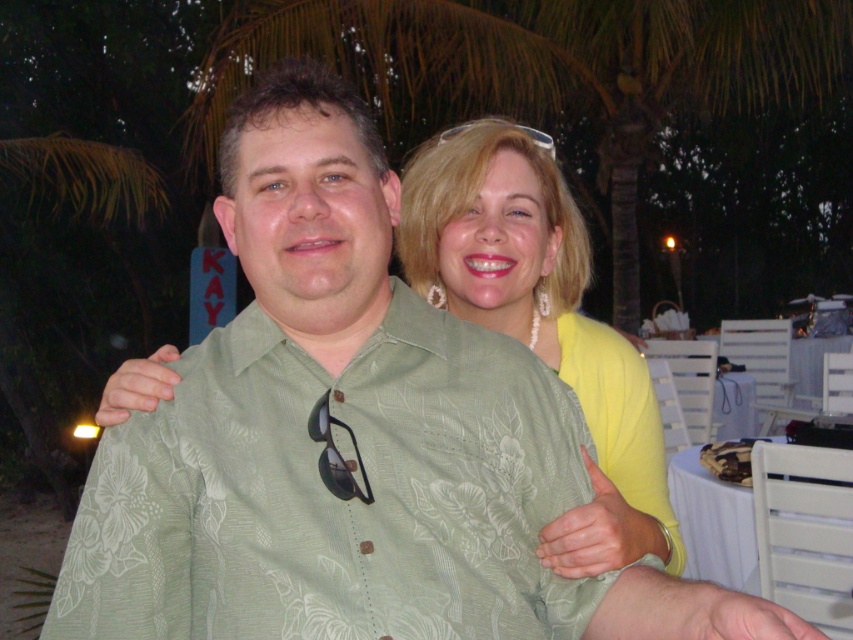
You are an artist sketching the scene and need to decide which object to draw first based on their widths. Which one should you start with, the green leafy palm tree at upper center or the pearl necklace at upper center?

The green leafy palm tree at upper center has a greater width than the pearl necklace at upper center, so you should start by drawing the green leafy palm tree at upper center first.

What is located at the coordinates point (335,493) in the image?

The green floral patterned shirt at center is located at point (335,493).